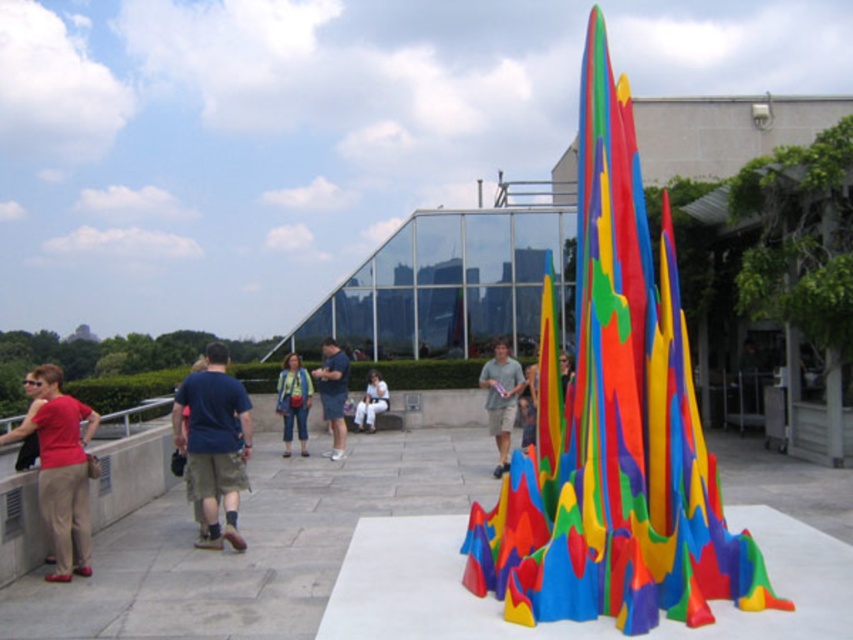
Is point (49, 369) behind point (201, 520)?

No, (49, 369) is closer to viewer.

Is point (51, 554) closer to camera compared to point (202, 531)?

That is True.

Who is more distant from viewer, (51, 403) or (190, 368)?

Point (190, 368)

Where is `matte red shirt at left`? The width and height of the screenshot is (853, 640). matte red shirt at left is located at coordinates (61, 470).

Based on the photo, does matte red shirt at left appear on the left side of matte gray shirt at center?

Correct, you'll find matte red shirt at left to the left of matte gray shirt at center.

Does matte red shirt at left have a smaller size compared to matte gray shirt at center?

No, matte red shirt at left is not smaller than matte gray shirt at center.

Does point (86, 460) come closer to viewer compared to point (486, 364)?

Yes.

Locate an element on the screen. The width and height of the screenshot is (853, 640). matte red shirt at left is located at coordinates (61, 470).

Is rubberized multicolored sculpture at center shorter than blue cotton shirt at center?

Incorrect, rubberized multicolored sculpture at center's height does not fall short of blue cotton shirt at center's.

Does rubberized multicolored sculpture at center have a larger size compared to blue cotton shirt at center?

No.

Which is in front, point (624, 561) or point (196, 499)?

Point (624, 561)

Image resolution: width=853 pixels, height=640 pixels. Find the location of `rubberized multicolored sculpture at center`. rubberized multicolored sculpture at center is located at coordinates (610, 433).